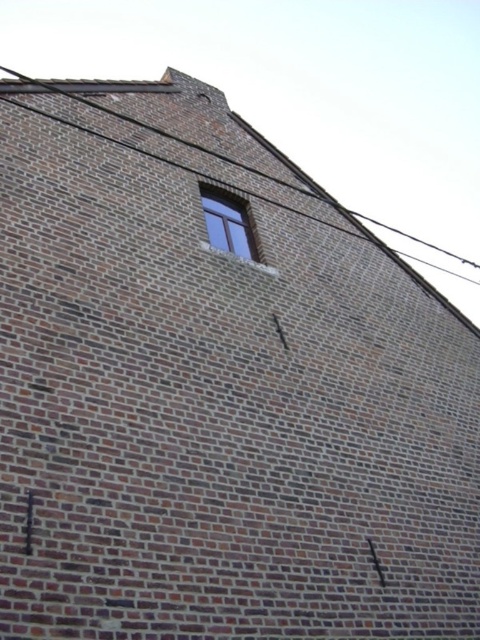
You are standing in front of a brick wall with a wooden window at upper center and a brown wire at upper center. Which object is positioned to the left of the other?

The brown wire at upper center is to the left of the wooden window at upper center.

You are an electrician assessing the wall. You need to determine if the brown wire at upper center can be safely moved without affecting the wooden window at upper center. Based on their heights, can the wire be moved downward without hitting the window?

The brown wire at upper center is taller than the wooden window at upper center. Moving it downward might bring it closer to or in contact with the window, so it is not advisable to move it without further assessment.

You are standing at the base of the brick wall and want to hang a picture frame that requires 5 meters of space between two points. Can you use the distance between the brown wire at upper center and the wooden window at upper center for this purpose?

The distance between the brown wire at upper center and the wooden window at upper center is 4.52 meters. Since the required space is 5 meters, which is longer than the available distance, the picture frame cannot be hung using this spacing.